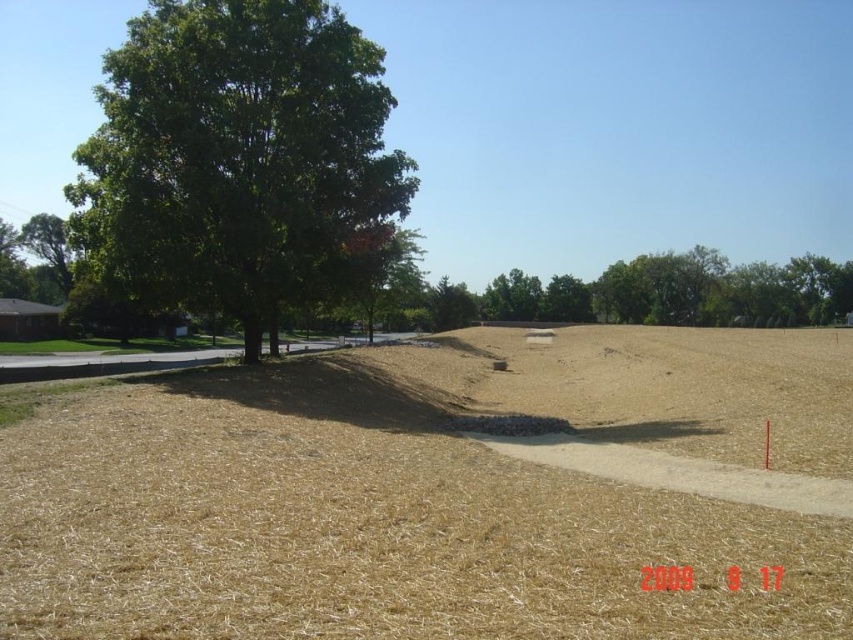
Question: Which object is farther from the camera taking this photo?

Choices:
 (A) brown dry grass at center
 (B) green leafy tree at center

Answer: (B)

Question: Does green leafy tree at left have a larger size compared to green leafy tree at center?

Choices:
 (A) no
 (B) yes

Answer: (A)

Question: Can you confirm if brown dry grass at center is positioned below green leafy tree at center?

Choices:
 (A) yes
 (B) no

Answer: (A)

Question: Based on their relative distances, which object is farther from the green leafy tree at left?

Choices:
 (A) brown dry grass at center
 (B) green leafy tree at center

Answer: (B)

Question: Which of the following is the farthest from the observer?

Choices:
 (A) (474, 472)
 (B) (245, 88)
 (C) (497, 300)

Answer: (C)

Question: Can you confirm if brown dry grass at center is bigger than green leafy tree at center?

Choices:
 (A) no
 (B) yes

Answer: (A)